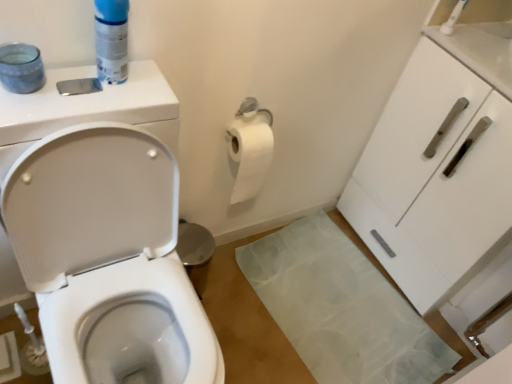
Locate an element on the screen. free space in front of blue plastic can at upper left is located at coordinates (75, 102).